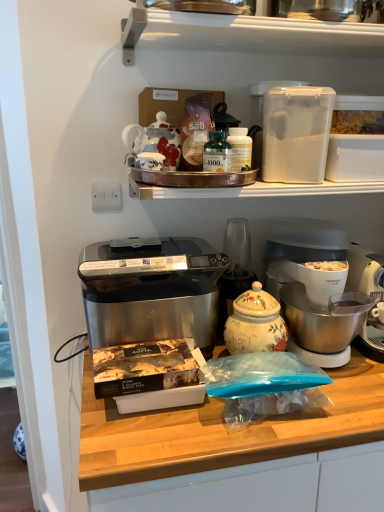
Locate an element on the screen. vacant space in front of satin black toaster oven at center is located at coordinates (153, 438).